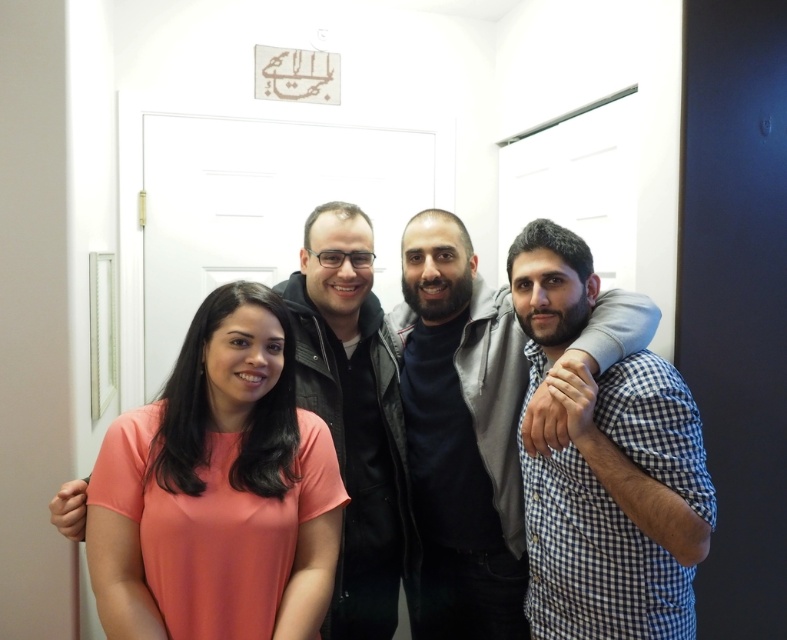
Can you confirm if blue checkered shirt at right is wider than dark gray sweater at center?

No.

Can you confirm if blue checkered shirt at right is smaller than dark gray sweater at center?

Incorrect, blue checkered shirt at right is not smaller in size than dark gray sweater at center.

The height and width of the screenshot is (640, 787). What are the coordinates of `blue checkered shirt at right` in the screenshot? It's located at (619, 508).

The image size is (787, 640). I want to click on blue checkered shirt at right, so click(x=619, y=508).

Is point (106, 448) positioned in front of point (573, 451)?

Yes.

Can you confirm if matte coral shirt at center is positioned above blue checkered shirt at right?

No.

The width and height of the screenshot is (787, 640). What are the coordinates of `matte coral shirt at center` in the screenshot? It's located at (218, 477).

Identify the location of matte coral shirt at center. This screenshot has width=787, height=640. (218, 477).

Is point (167, 563) more distant than point (429, 296)?

That is False.

The height and width of the screenshot is (640, 787). What do you see at coordinates (218, 477) in the screenshot?
I see `matte coral shirt at center` at bounding box center [218, 477].

What do you see at coordinates (218, 477) in the screenshot?
I see `matte coral shirt at center` at bounding box center [218, 477].

The height and width of the screenshot is (640, 787). What are the coordinates of `matte coral shirt at center` in the screenshot? It's located at (218, 477).